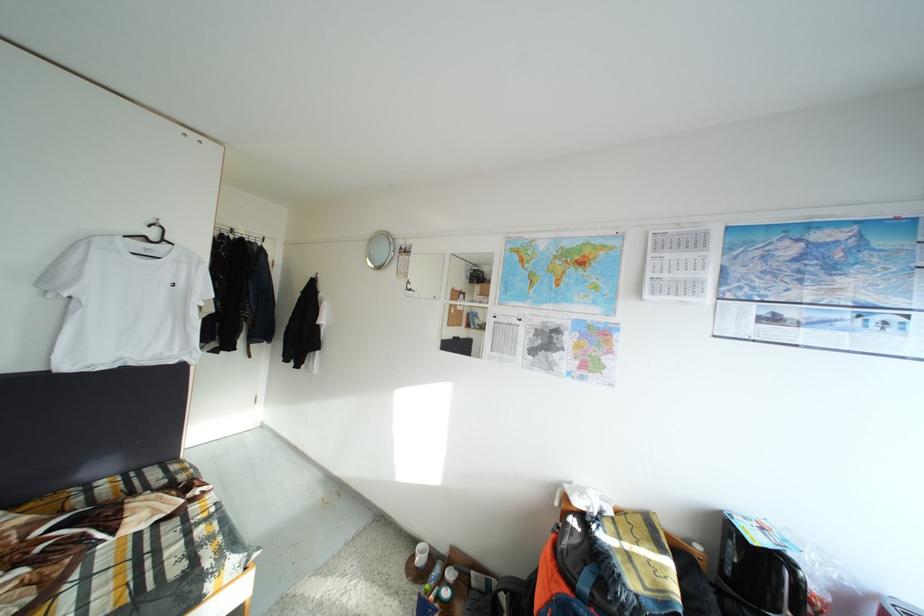
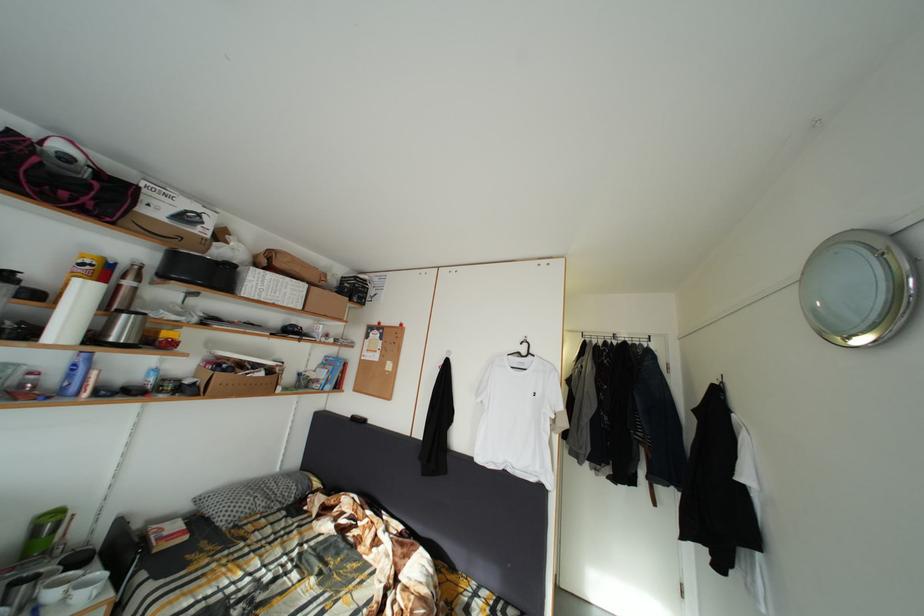
First-person continuous shooting, in which direction is the camera rotating?

The rotation direction of the camera is left-up.